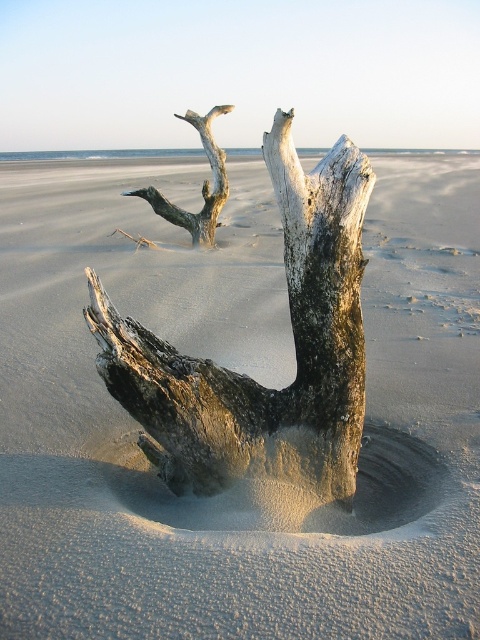
Between weathered wood driftwood at center and gray weathered wood at upper center, which one is positioned higher?

gray weathered wood at upper center is higher up.

Does weathered wood driftwood at center appear on the right side of gray weathered wood at upper center?

Yes, weathered wood driftwood at center is to the right of gray weathered wood at upper center.

Which is behind, point (296, 308) or point (225, 198)?

Positioned behind is point (225, 198).

Locate an element on the screen. weathered wood driftwood at center is located at coordinates (252, 378).